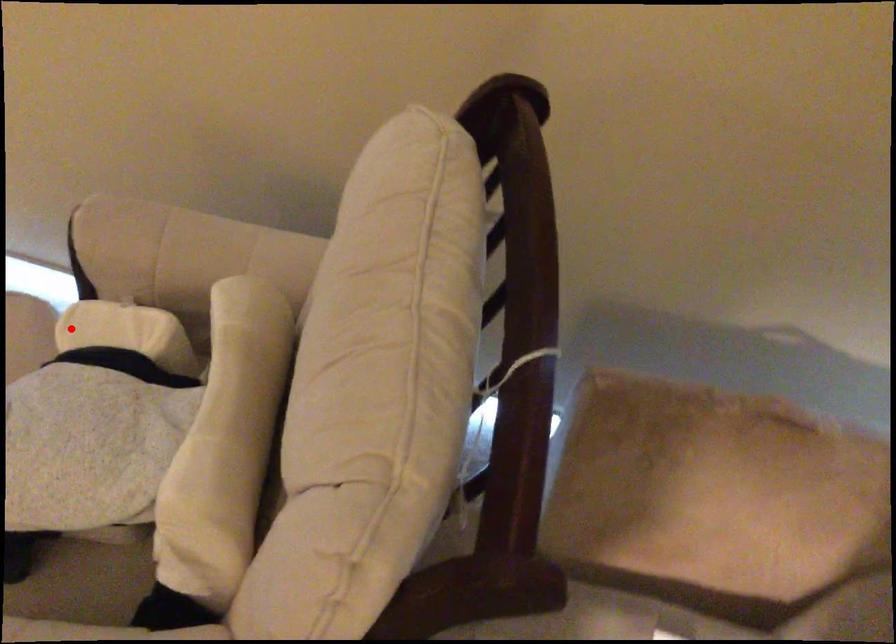
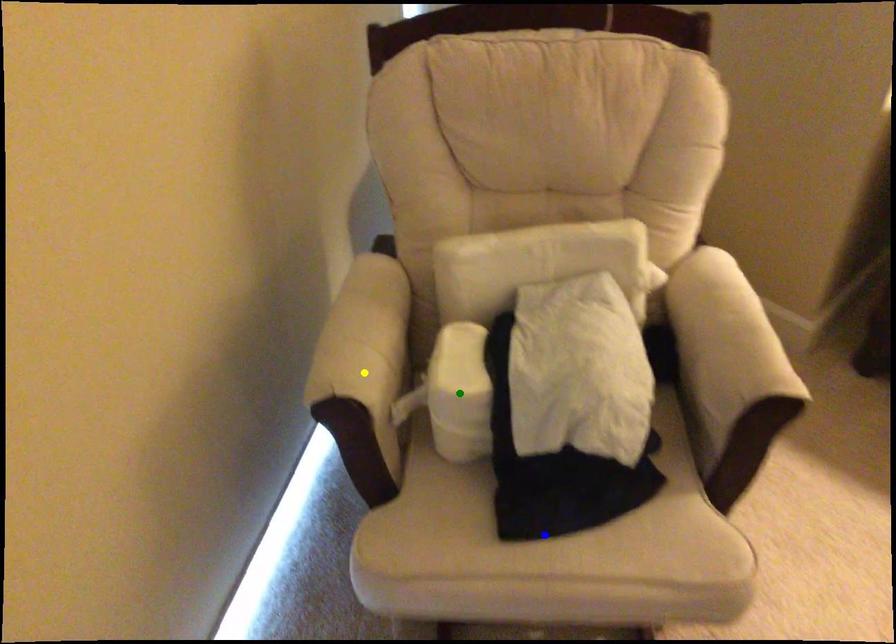
Question: I am providing you with two images of the same scene from different viewpoints. A red point is marked on the first image. You are given multiple points on the second image. Which point in image 2 represents the same 3d spot as the red point in image 1?

Choices:
 (A) yellow point
 (B) green point
 (C) blue point

Answer: (B)